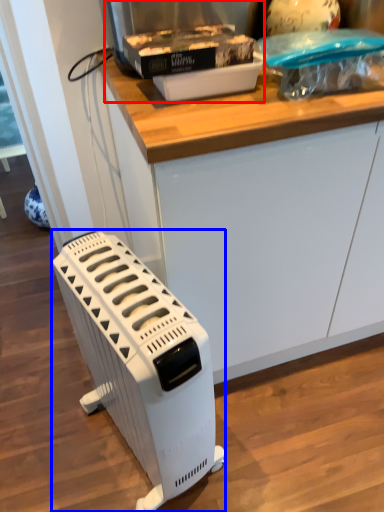
Question: Which point is further to the camera, appliance (highlighted by a red box) or home appliance (highlighted by a blue box)?

Choices:
 (A) appliance
 (B) home appliance

Answer: (A)